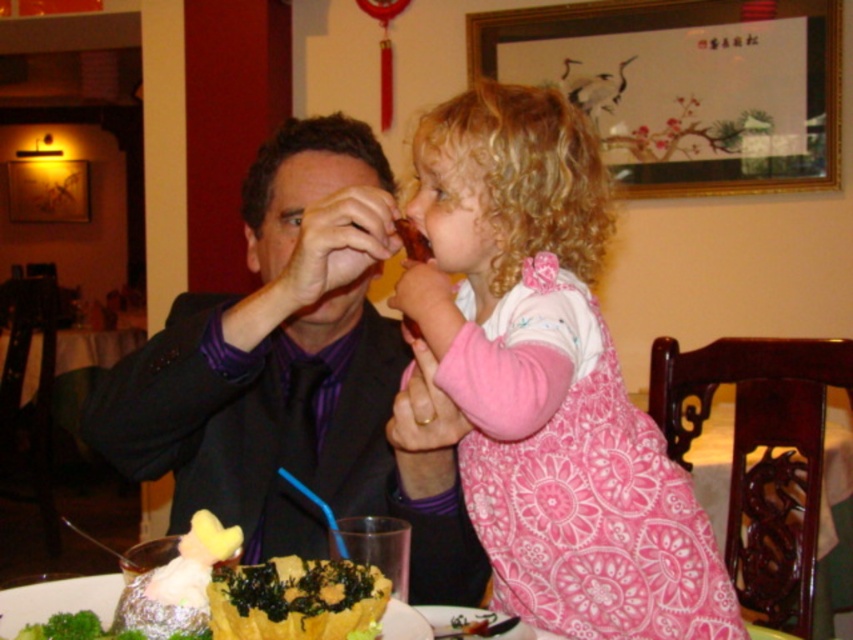
Question: Is pink floral dress at upper right thinner than yellow matte bowl at lower center?

Choices:
 (A) no
 (B) yes

Answer: (A)

Question: Does pink floral dress at upper right have a greater width compared to yellow matte bowl at lower center?

Choices:
 (A) yes
 (B) no

Answer: (A)

Question: Which of the following is the farthest from the observer?

Choices:
 (A) shiny foil bowl at lower left
 (B) matte black suit at center
 (C) yellow matte bowl at lower center
 (D) matte brown food at upper center

Answer: (D)

Question: Does pink floral dress at upper right appear on the right side of matte brown food at upper center?

Choices:
 (A) no
 (B) yes

Answer: (B)

Question: Which object is the closest to the matte brown food at upper center?

Choices:
 (A) shiny foil bowl at lower left
 (B) matte black suit at center
 (C) yellow matte bowl at lower center

Answer: (B)

Question: Based on their relative distances, which object is nearer to the matte brown food at upper center?

Choices:
 (A) shiny foil bowl at lower left
 (B) pink floral dress at upper right
 (C) yellow matte bowl at lower center
 (D) matte black suit at center

Answer: (B)